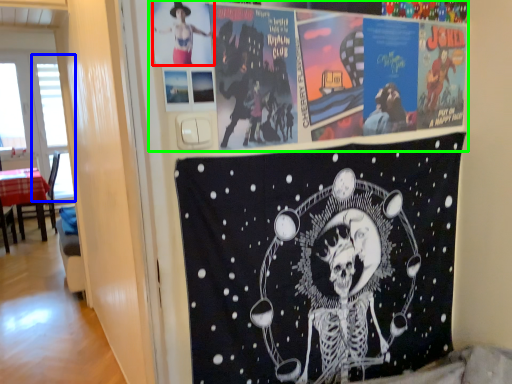
Question: Which is farther away from person (highlighted by a red box)? window screen (highlighted by a blue box) or poster (highlighted by a green box)?

Choices:
 (A) window screen
 (B) poster

Answer: (A)